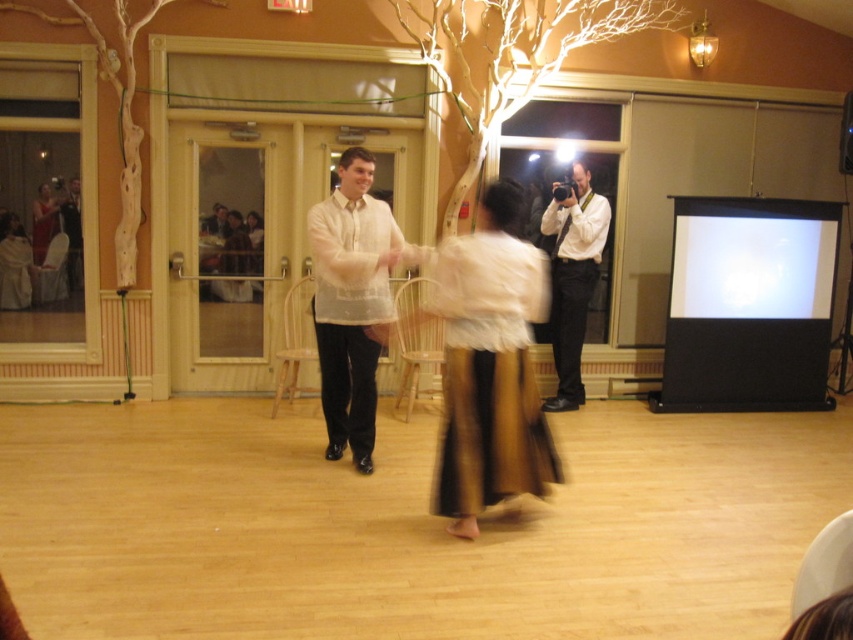
You are a photographer at the event and want to capture a photo focusing on the gold shimmering skirt at center and the gold metallic skirt at center. Which skirt appears larger in the photo?

The gold shimmering skirt at center appears larger in the photo because it is closer to the viewer than the gold metallic skirt at center.

You are standing at the entrance of the dance hall and want to locate the white sheer shirt at center. According to the coordinates provided, where would you look to find it?

The white sheer shirt at center is located at the 2D coordinates point (351, 301), which would be slightly to the right and below the center of the image.